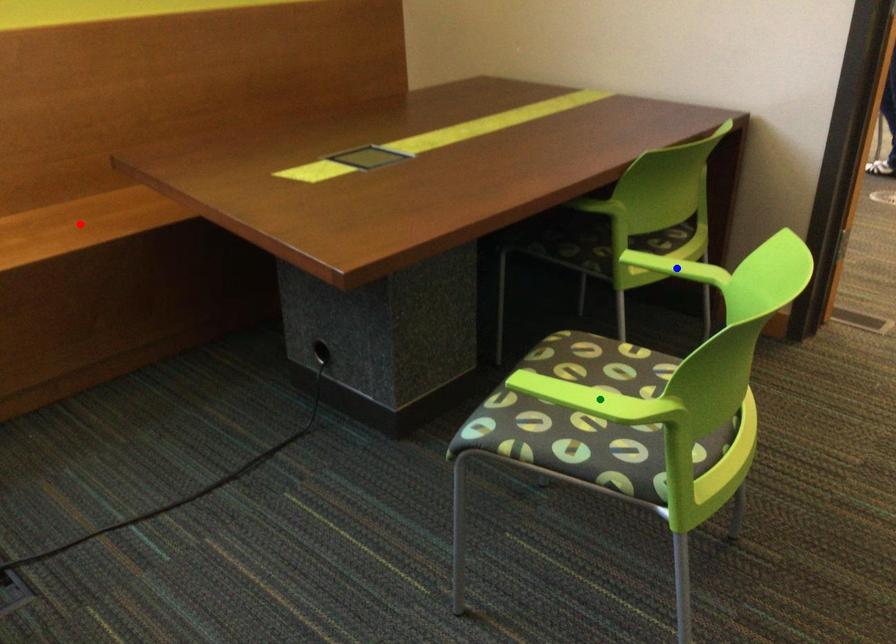
Order these from nearest to farthest:
- green point
- blue point
- red point

red point
blue point
green point